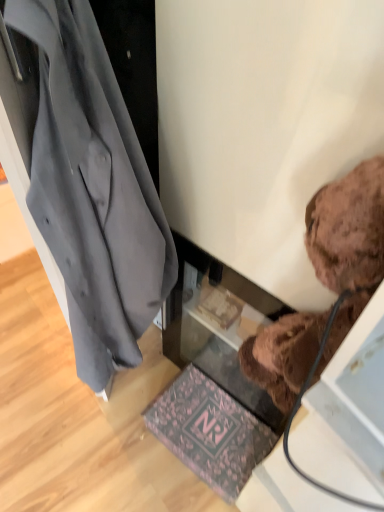
Question: Should I look upward or downward to see dark gray fabric coat at left?

Choices:
 (A) down
 (B) up

Answer: (A)

Question: From the image's perspective, does pink floral mat at lower center appear higher than dark gray fabric coat at left?

Choices:
 (A) no
 (B) yes

Answer: (A)

Question: Is pink floral mat at lower center wider than dark gray fabric coat at left?

Choices:
 (A) no
 (B) yes

Answer: (A)

Question: Are pink floral mat at lower center and dark gray fabric coat at left located far from each other?

Choices:
 (A) yes
 (B) no

Answer: (B)

Question: From a real-world perspective, is pink floral mat at lower center on dark gray fabric coat at left?

Choices:
 (A) no
 (B) yes

Answer: (A)

Question: Is pink floral mat at lower center turned away from dark gray fabric coat at left?

Choices:
 (A) yes
 (B) no

Answer: (B)

Question: From a real-world perspective, does pink floral mat at lower center sit lower than dark gray fabric coat at left?

Choices:
 (A) yes
 (B) no

Answer: (A)

Question: Is dark gray fabric coat at left turned away from brown plush teddy bear at upper right?

Choices:
 (A) no
 (B) yes

Answer: (A)

Question: From a real-world perspective, is dark gray fabric coat at left located beneath brown plush teddy bear at upper right?

Choices:
 (A) yes
 (B) no

Answer: (A)

Question: Is dark gray fabric coat at left not within brown plush teddy bear at upper right?

Choices:
 (A) no
 (B) yes

Answer: (B)

Question: Considering the relative sizes of dark gray fabric coat at left and brown plush teddy bear at upper right in the image provided, is dark gray fabric coat at left wider than brown plush teddy bear at upper right?

Choices:
 (A) no
 (B) yes

Answer: (B)

Question: Is dark gray fabric coat at left at the right side of brown plush teddy bear at upper right?

Choices:
 (A) no
 (B) yes

Answer: (A)

Question: Does dark gray fabric coat at left have a lesser height compared to brown plush teddy bear at upper right?

Choices:
 (A) yes
 (B) no

Answer: (B)

Question: Is brown plush teddy bear at upper right thinner than pink floral mat at lower center?

Choices:
 (A) yes
 (B) no

Answer: (A)